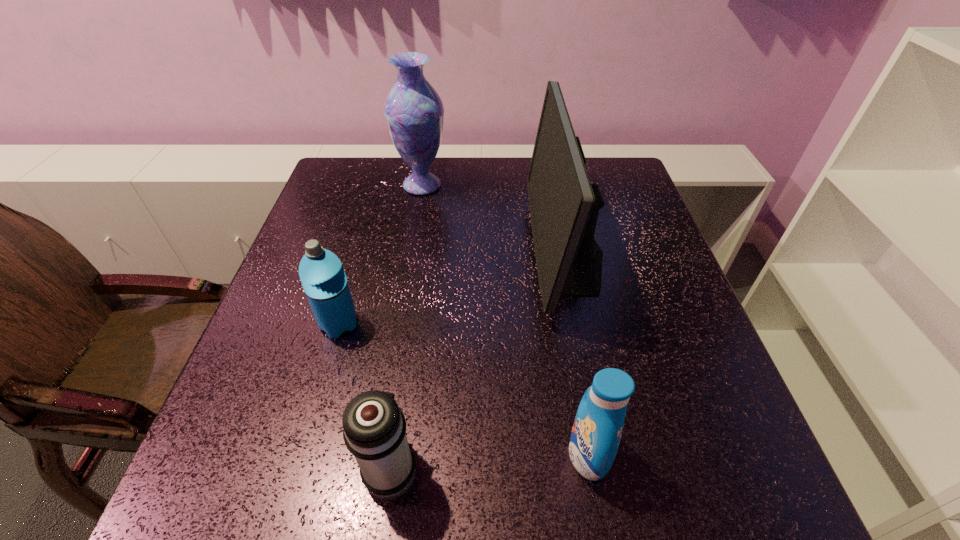
This screenshot has height=540, width=960. Identify the location of thermos bottle located in the near edge section of the desktop. (374, 428).

What are the coordinates of `object that is at the left edge` in the screenshot? It's located at (322, 275).

I want to click on object located at the right edge, so click(x=564, y=205).

The width and height of the screenshot is (960, 540). I want to click on object that is at the far right corner, so click(x=564, y=205).

Image resolution: width=960 pixels, height=540 pixels. In the image, there is a desktop. Identify the location of free space at the far edge. (438, 167).

The image size is (960, 540). Identify the location of free space at the near edge. (324, 478).

At what (x,y) coordinates should I click in order to perform the action: click on free space at the left edge. Please return your answer as a coordinate pair (x, y). Looking at the image, I should click on (327, 220).

Identify the location of blank space at the right edge of the desktop. (641, 307).

You are a GUI agent. You are given a task and a screenshot of the screen. Output one action in this format:
    pyautogui.click(x=<x>, y=<y>)
    Task: Click on the vacant region at the far left corner of the desktop
    
    Given the screenshot: What is the action you would take?
    pyautogui.click(x=386, y=167)

Locate an element on the screen. blank space at the far right corner is located at coordinates (633, 179).